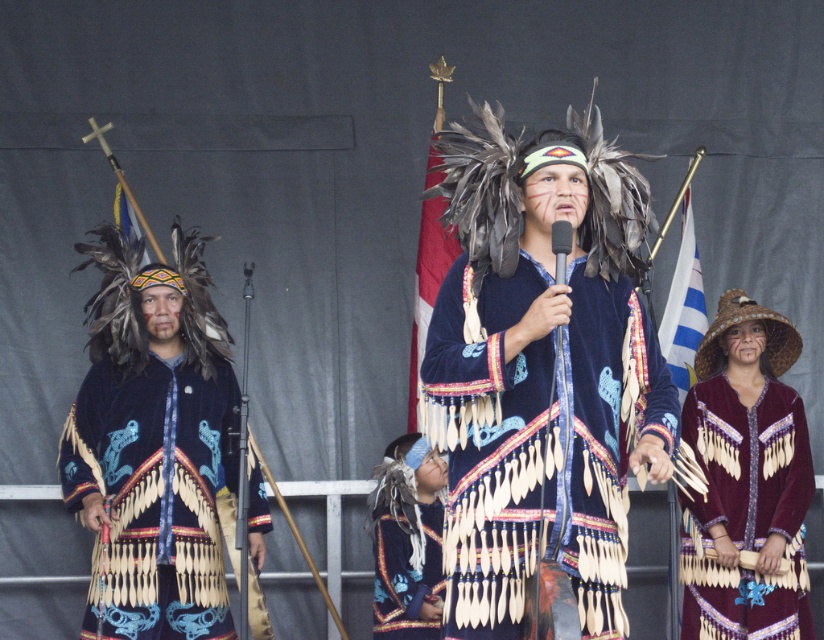
Based on the scene description, where is the velvet blue coat with fringe at left located in the image?

The velvet blue coat with fringe at left is located at point 0.692 on the horizontal axis and 0.187 on the vertical axis.

You are an event organizer who needs to arrange seating for the attendees. The maroon velvet dress at lower right and the velvet blue vest at center are part of the performers. Which performer should you seat closer to the front of the stage?

The velvet blue vest at center should be seated closer to the front of the stage because the maroon velvet dress at lower right is located above it, indicating it is positioned higher on the stage.

You are an anthropologist observing the scene and need to document the cultural items. Which object, the velvet blue headdress at center or the maroon velvet dress at lower right, is bigger in size?

The velvet blue headdress at center has a larger size compared to the maroon velvet dress at lower right.